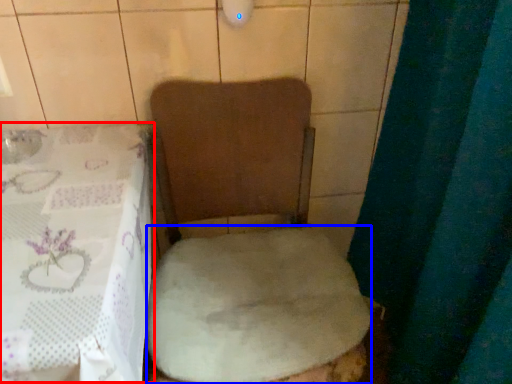
Question: Which object appears farthest to the camera in this image, table (highlighted by a red box) or sheet (highlighted by a blue box)?

Choices:
 (A) table
 (B) sheet

Answer: (B)